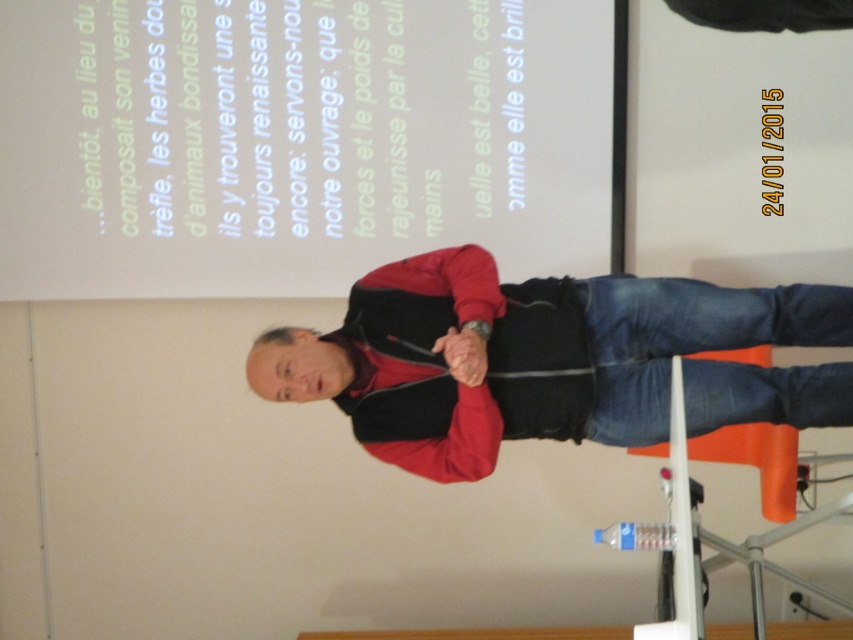
Question: Is white paper at upper center thinner than red matte jacket at center?

Choices:
 (A) no
 (B) yes

Answer: (A)

Question: Based on their relative distances, which object is farther from the blue denim jeans at lower center?

Choices:
 (A) red matte jacket at center
 (B) white paper at upper center

Answer: (B)

Question: From the image, what is the correct spatial relationship of white paper at upper center in relation to blue denim jeans at lower center?

Choices:
 (A) above
 (B) below

Answer: (A)

Question: Which of the following is the closest to the observer?

Choices:
 (A) (706, 364)
 (B) (636, 403)
 (C) (248, 240)

Answer: (B)

Question: Which point is closer to the camera?

Choices:
 (A) (489, 122)
 (B) (442, 406)

Answer: (B)

Question: Can you confirm if red matte jacket at center is positioned to the left of blue denim jeans at lower center?

Choices:
 (A) yes
 (B) no

Answer: (A)